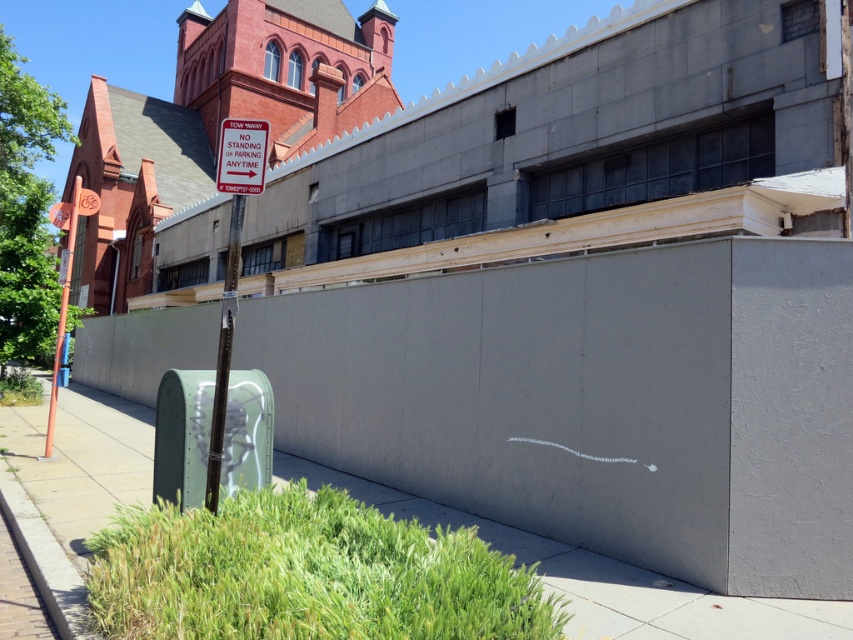
Question: Among these objects, which one is farthest from the camera?

Choices:
 (A) smooth concrete pavement at lower center
 (B) orange plastic sign at left
 (C) red plastic sign at upper left
 (D) brick church at upper left

Answer: (B)

Question: Is red plastic sign at upper left positioned before orange plastic sign at left?

Choices:
 (A) yes
 (B) no

Answer: (A)

Question: Can you confirm if smooth concrete pavement at lower center is positioned below orange plastic sign at left?

Choices:
 (A) no
 (B) yes

Answer: (B)

Question: Can you confirm if smooth concrete pavement at lower center is wider than orange plastic sign at left?

Choices:
 (A) no
 (B) yes

Answer: (A)

Question: Which point is closer to the camera?

Choices:
 (A) brick church at upper left
 (B) red plastic sign at upper left

Answer: (A)

Question: Among these points, which one is nearest to the camera?

Choices:
 (A) (242, 131)
 (B) (120, 116)
 (C) (77, 220)
 (D) (68, 499)

Answer: (A)